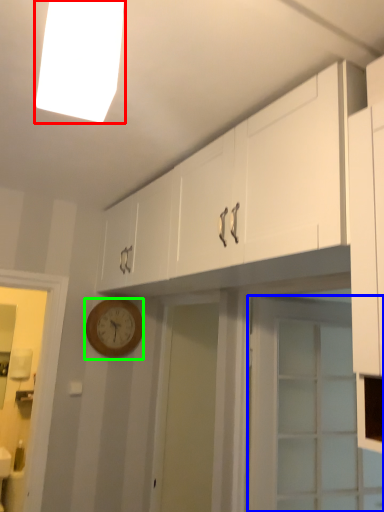
Question: Which is nearer to the lighting (highlighted by a red box)? door (highlighted by a blue box) or wall clock (highlighted by a green box).

Choices:
 (A) door
 (B) wall clock

Answer: (A)